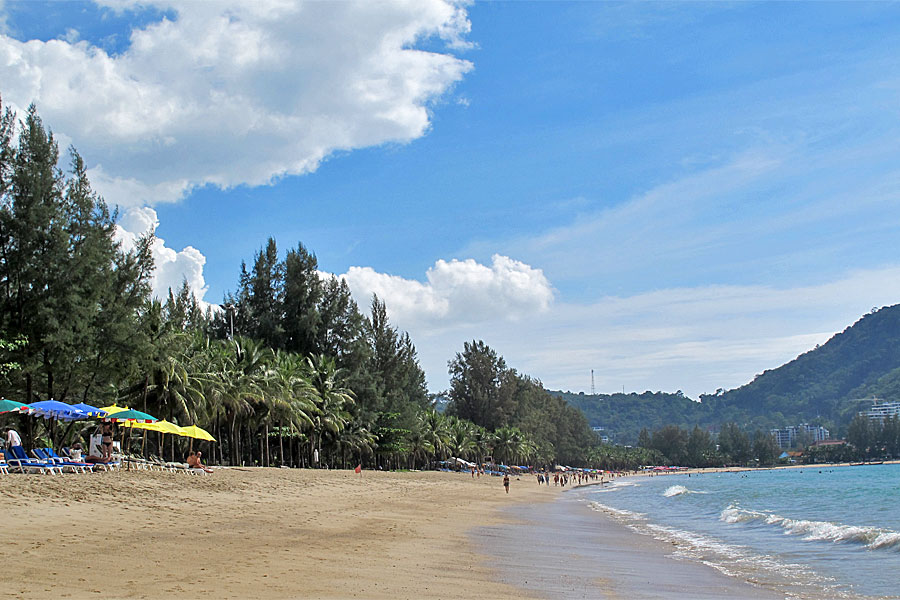
Identify the location of lounge chairs. The width and height of the screenshot is (900, 600). (28, 465), (38, 462), (49, 459), (122, 459), (144, 459).